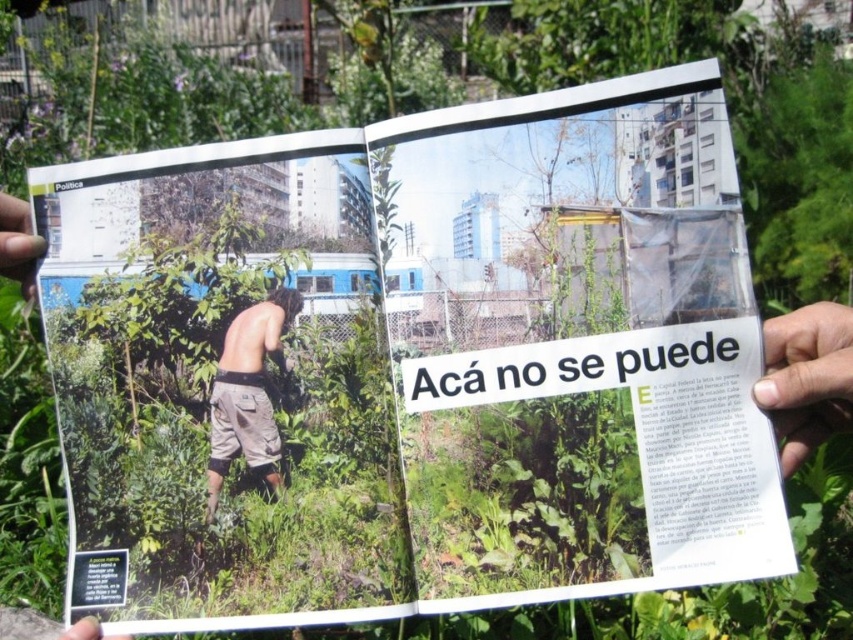
Is tan canvas shorts at center closer to the viewer compared to smooth skin hand at upper left?

No.

Looking at this image, measure the distance between tan canvas shorts at center and camera.

The distance of tan canvas shorts at center from camera is 20.02 inches.

Find the location of `tan canvas shorts at center`. tan canvas shorts at center is located at coordinates (248, 394).

Is point (758, 404) positioned before point (244, 358)?

Yes, point (758, 404) is closer to viewer.

Based on the photo, who is shorter, dark skin hand at right or tan canvas shorts at center?

dark skin hand at right is shorter.

Locate an element on the screen. This screenshot has width=853, height=640. dark skin hand at right is located at coordinates (805, 378).

Where is `dark skin hand at right`? The width and height of the screenshot is (853, 640). dark skin hand at right is located at coordinates (805, 378).

Who is more distant from viewer, (839, 337) or (42, 241)?

Positioned behind is point (42, 241).

Does dark skin hand at right have a smaller size compared to smooth skin hand at upper left?

Incorrect, dark skin hand at right is not smaller in size than smooth skin hand at upper left.

Is point (793, 365) closer to camera compared to point (28, 296)?

Yes, it is.

Where is `dark skin hand at right`? dark skin hand at right is located at coordinates (805, 378).